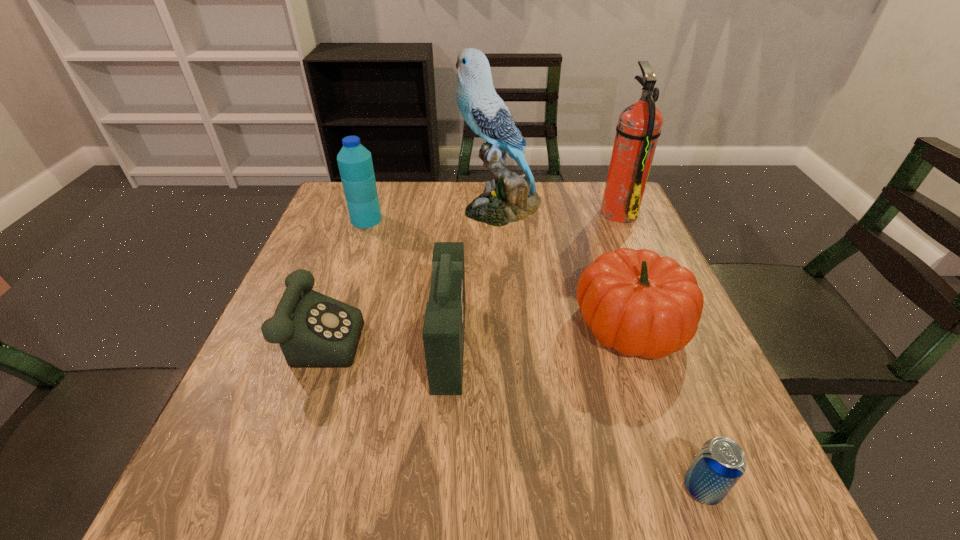
What are the coordinates of `vacant region located on the face of the parakeet` in the screenshot? It's located at [x=334, y=207].

The width and height of the screenshot is (960, 540). Identify the location of vacant space located 0.350m at the nozzle of the fire extinguisher. (475, 212).

The width and height of the screenshot is (960, 540). Find the location of `free region located at the nozzle of the fire extinguisher`. free region located at the nozzle of the fire extinguisher is located at coordinates (567, 212).

I want to click on vacant area situated at the nozzle of the fire extinguisher, so click(478, 212).

I want to click on free space located 0.280m on the front of the water bottle, so click(x=338, y=302).

The height and width of the screenshot is (540, 960). In order to click on free space located on the front-facing side of the first-aid kit in this screenshot , I will do `click(564, 345)`.

Where is `blank space located 0.190m on the back of the pumpkin`? The width and height of the screenshot is (960, 540). blank space located 0.190m on the back of the pumpkin is located at coordinates (601, 238).

Find the location of `free space located on the dial of the second shortest object`. free space located on the dial of the second shortest object is located at coordinates (427, 327).

Where is `vacant area situated on the left of the nearest object`? vacant area situated on the left of the nearest object is located at coordinates (643, 488).

Find the location of a particular element. parakeet that is at the far edge is located at coordinates (508, 198).